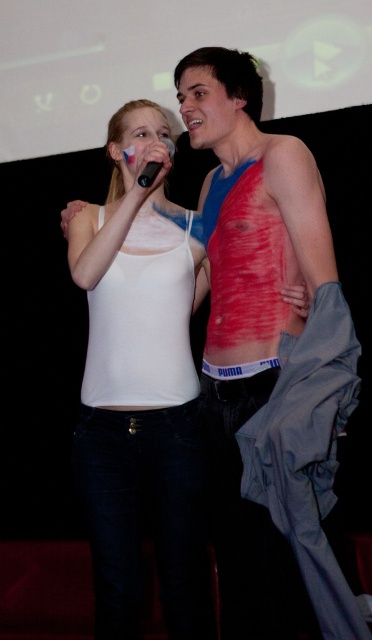
Which is behind, point (117, 342) or point (158, 164)?

Positioned behind is point (117, 342).

Who is more distant from viewer, (126,147) or (161,163)?

The point (126,147) is behind.

I want to click on white matte tank top at center, so click(139, 392).